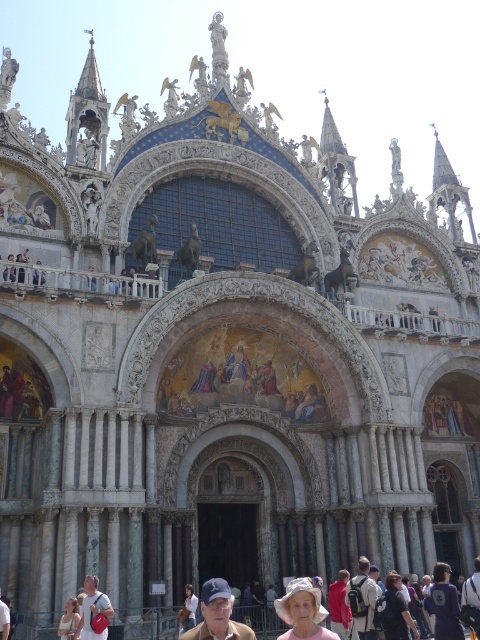
Between light beige fabric hat at lower center and blue fabric cap at lower center, which one is positioned lower?

Positioned lower is blue fabric cap at lower center.

Is point (307, 605) positioned behind point (202, 593)?

No, (307, 605) is in front of (202, 593).

Where is `light beige fabric hat at lower center`? This screenshot has height=640, width=480. light beige fabric hat at lower center is located at coordinates (302, 611).

Between pink fabric at center and matte pink backpack at lower left, which one is positioned higher?

Positioned higher is matte pink backpack at lower left.

Is point (395, 604) closer to camera compared to point (106, 602)?

No, it is not.

Where is `pink fabric at center`? pink fabric at center is located at coordinates (396, 611).

I want to click on pink fabric at center, so click(x=396, y=611).

Can you confirm if light beige fabric hat at lower center is positioned to the right of matte pink backpack at lower left?

Yes, light beige fabric hat at lower center is to the right of matte pink backpack at lower left.

Can you confirm if light beige fabric hat at lower center is smaller than matte pink backpack at lower left?

No.

Between point (278, 605) and point (92, 582), which one is positioned behind?

The point (92, 582) is more distant.

The image size is (480, 640). What are the coordinates of `light beige fabric hat at lower center` in the screenshot? It's located at (302, 611).